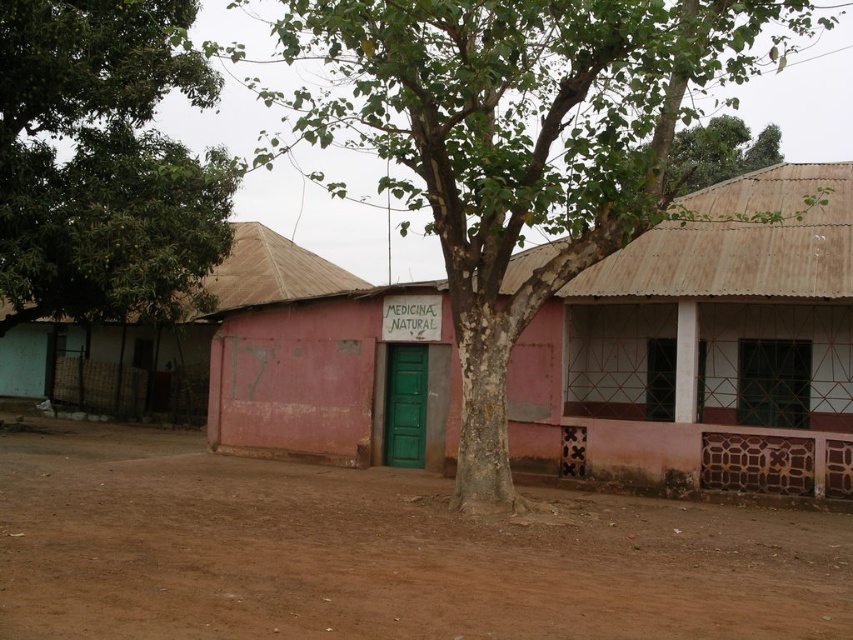
Looking at this image, which is more to the right, green bark tree at center or pink matte building at center?

green bark tree at center

The width and height of the screenshot is (853, 640). What are the coordinates of `green bark tree at center` in the screenshot? It's located at (518, 141).

This screenshot has height=640, width=853. I want to click on green bark tree at center, so click(518, 141).

Between point (21, 106) and point (325, 260), which one is positioned in front?

Point (21, 106) is in front.

The height and width of the screenshot is (640, 853). I want to click on green leafy tree at center, so click(x=103, y=163).

Is point (498, 636) positioned after point (151, 369)?

No, it is in front of (151, 369).

This screenshot has width=853, height=640. I want to click on brown dirt field at lower center, so click(379, 554).

Locate an element on the screen. The image size is (853, 640). brown dirt field at lower center is located at coordinates (379, 554).